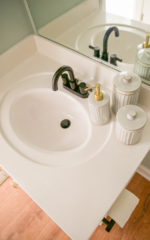
Locate an element on the screen. The height and width of the screenshot is (240, 150). right faucet handle is located at coordinates pyautogui.click(x=81, y=85).